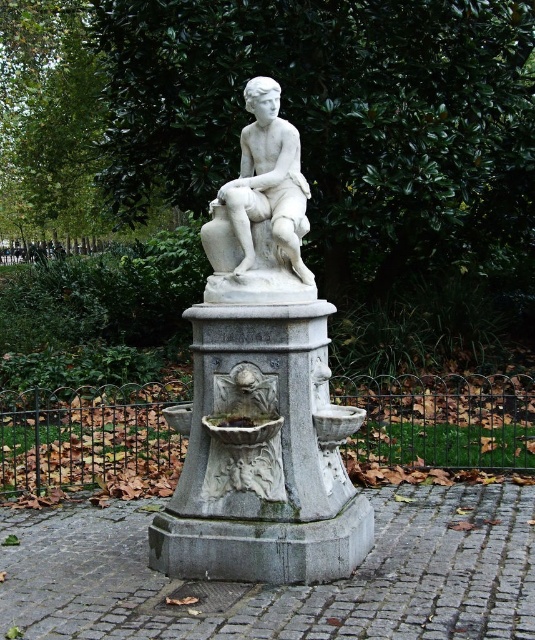
Question: Can you confirm if gray stone fountain at center is wider than iron wire fence at center?

Choices:
 (A) no
 (B) yes

Answer: (A)

Question: Is gray stone fountain at center behind iron wire fence at center?

Choices:
 (A) yes
 (B) no

Answer: (B)

Question: Which point is closer to the camera?

Choices:
 (A) (225, 209)
 (B) (325, 532)

Answer: (B)

Question: Based on their relative distances, which object is farther from the gray stone fountain at center?

Choices:
 (A) white marble statue at center
 (B) iron wire fence at center

Answer: (B)

Question: Can you confirm if iron wire fence at center is positioned to the right of white marble statue at center?

Choices:
 (A) yes
 (B) no

Answer: (B)

Question: Which object is the farthest from the iron wire fence at center?

Choices:
 (A) gray stone fountain at center
 (B) white marble statue at center

Answer: (B)